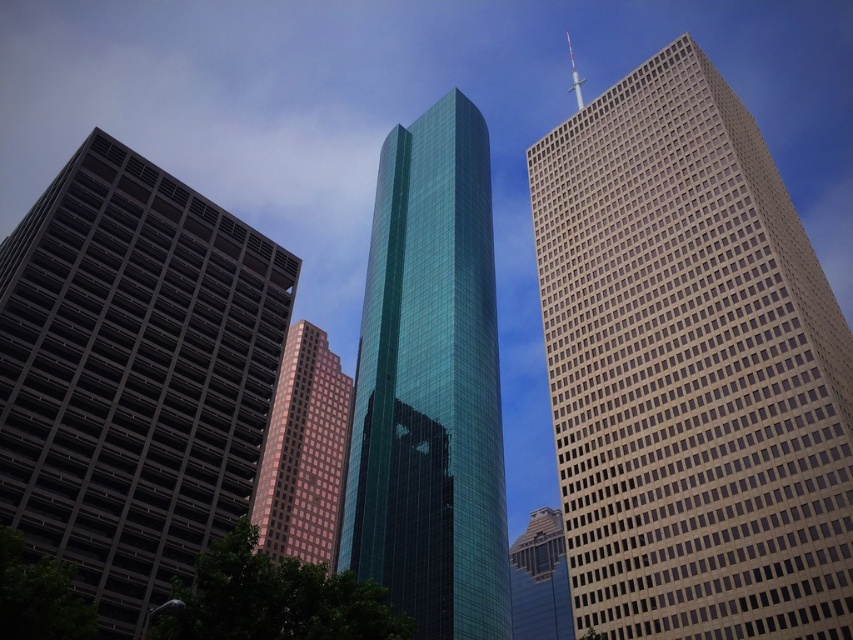
Is green glass skyscraper at center positioned at the back of shiny glass skyscraper at center?

No, it is in front of shiny glass skyscraper at center.

The image size is (853, 640). What do you see at coordinates (430, 387) in the screenshot? I see `green glass skyscraper at center` at bounding box center [430, 387].

Find the location of `green glass skyscraper at center`. green glass skyscraper at center is located at coordinates (430, 387).

Which is in front, point (207, 476) or point (509, 570)?

Point (207, 476) is more forward.

Who is higher up, dark gray concrete building at left or shiny glass skyscraper at center?

Positioned higher is dark gray concrete building at left.

Does point (193, 353) come closer to viewer compared to point (525, 604)?

Yes.

Image resolution: width=853 pixels, height=640 pixels. In order to click on dark gray concrete building at left in this screenshot , I will do `click(132, 374)`.

Can you confirm if beige grid-patterned building at right is positioned to the left of pink glass building at center?

No, beige grid-patterned building at right is not to the left of pink glass building at center.

In the scene shown: Which is below, beige grid-patterned building at right or pink glass building at center?

pink glass building at center is below.

In order to click on beige grid-patterned building at right in this screenshot , I will do `click(689, 369)`.

Locate an element on the screen. This screenshot has height=640, width=853. beige grid-patterned building at right is located at coordinates (689, 369).